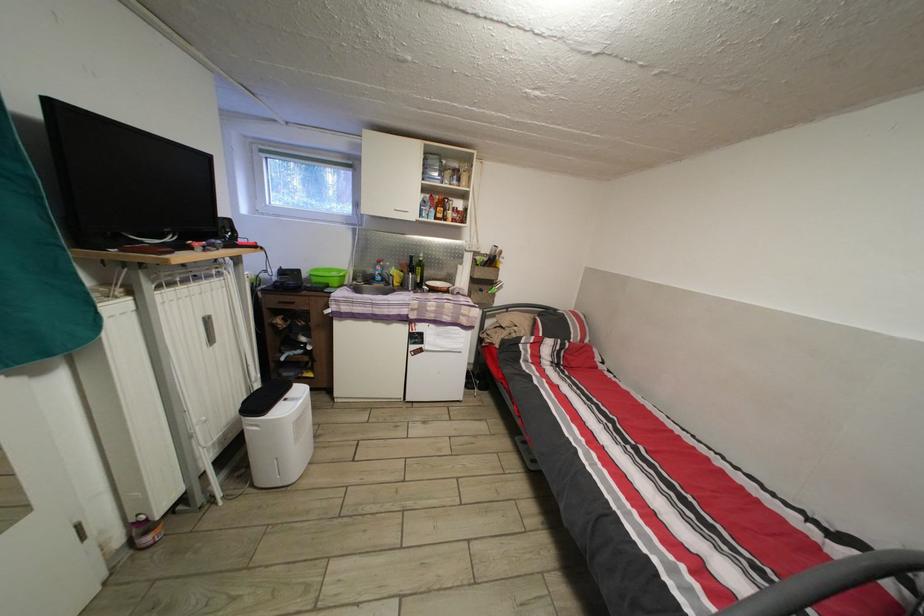
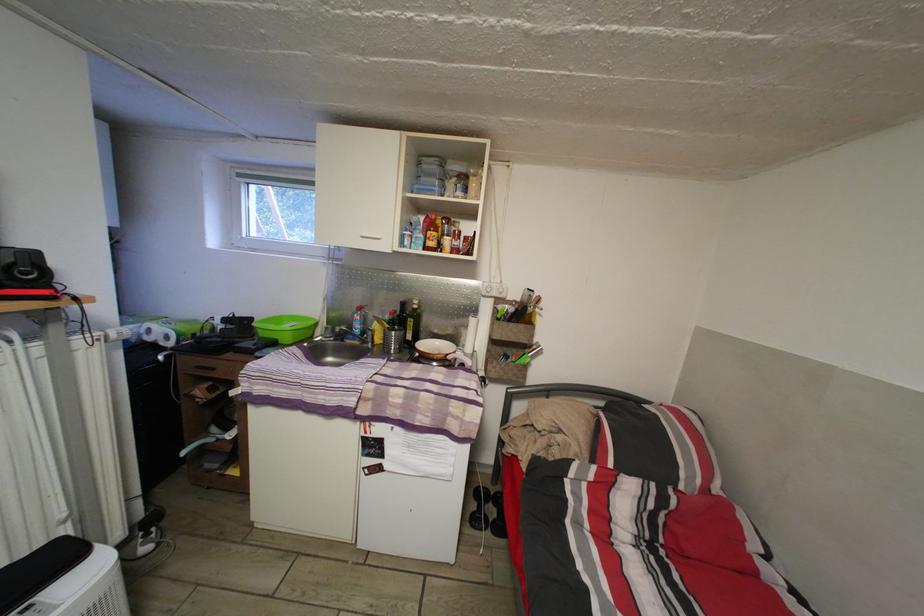
Where in the second image is the point corresponding to point 426,286 from the first image?

(417, 344)